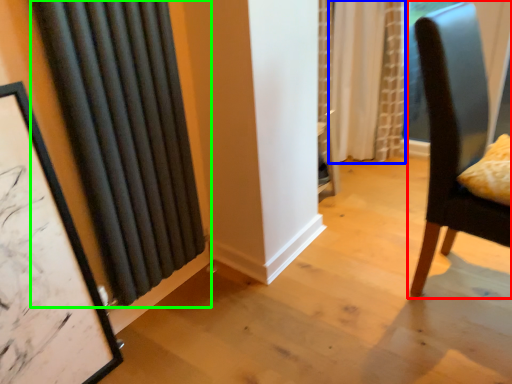
Question: Estimate the real-world distances between objects in this image. Which object is farther from chair (highlighted by a red box), curtain (highlighted by a blue box) or curtain (highlighted by a green box)?

Choices:
 (A) curtain
 (B) curtain

Answer: (A)